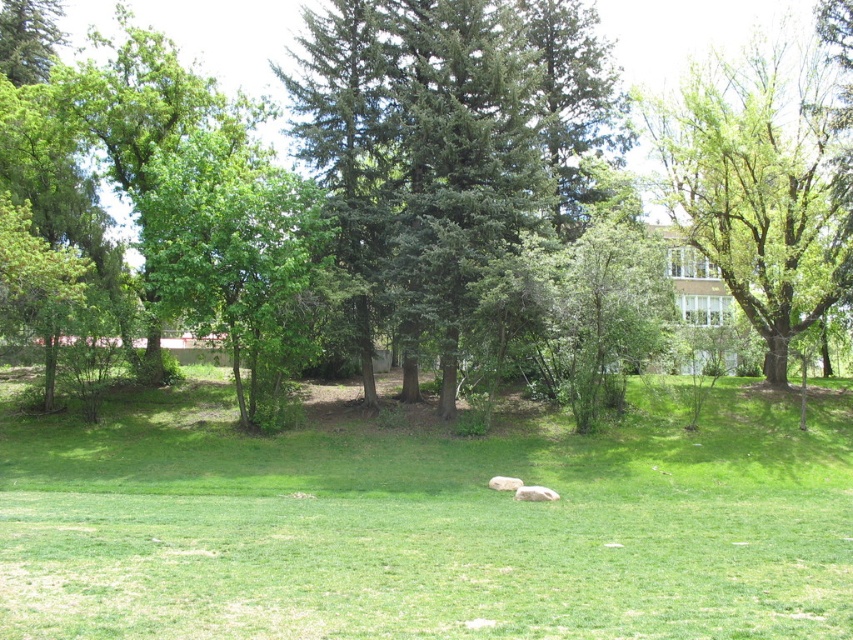
Which is above, green leafy tree at upper right or green leafy tree at center?

green leafy tree at center is higher up.

Looking at this image, does green leafy tree at upper right have a lesser width compared to green leafy tree at center?

Yes.

Locate an element on the screen. The image size is (853, 640). green leafy tree at upper right is located at coordinates (758, 189).

Where is `green leafy tree at upper right`? green leafy tree at upper right is located at coordinates (x=758, y=189).

Can you confirm if green grassy field at center is positioned above green leafy tree at upper right?

No, green grassy field at center is not above green leafy tree at upper right.

The width and height of the screenshot is (853, 640). What do you see at coordinates (426, 528) in the screenshot?
I see `green grassy field at center` at bounding box center [426, 528].

Is point (724, 515) positioned after point (724, 252)?

No.

You are a GUI agent. You are given a task and a screenshot of the screen. Output one action in this format:
    pyautogui.click(x=<x>, y=<y>)
    Task: Click on the green grassy field at center
    
    Given the screenshot: What is the action you would take?
    pyautogui.click(x=426, y=528)

Consider the image. Is green grassy field at center to the left of green leafy tree at center from the viewer's perspective?

Yes, green grassy field at center is to the left of green leafy tree at center.

Is point (170, 636) closer to viewer compared to point (172, 22)?

Yes, point (170, 636) is in front of point (172, 22).

I want to click on green grassy field at center, so click(x=426, y=528).